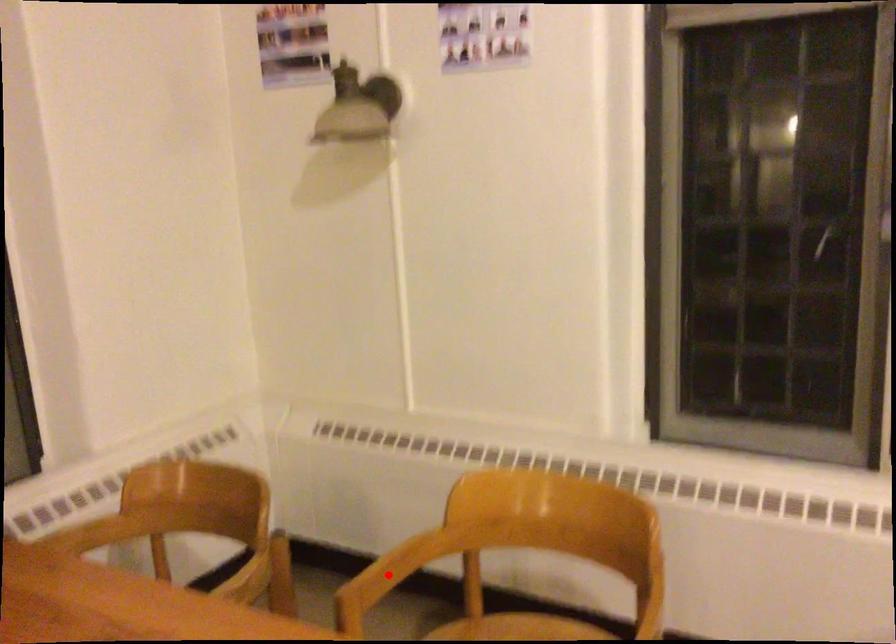
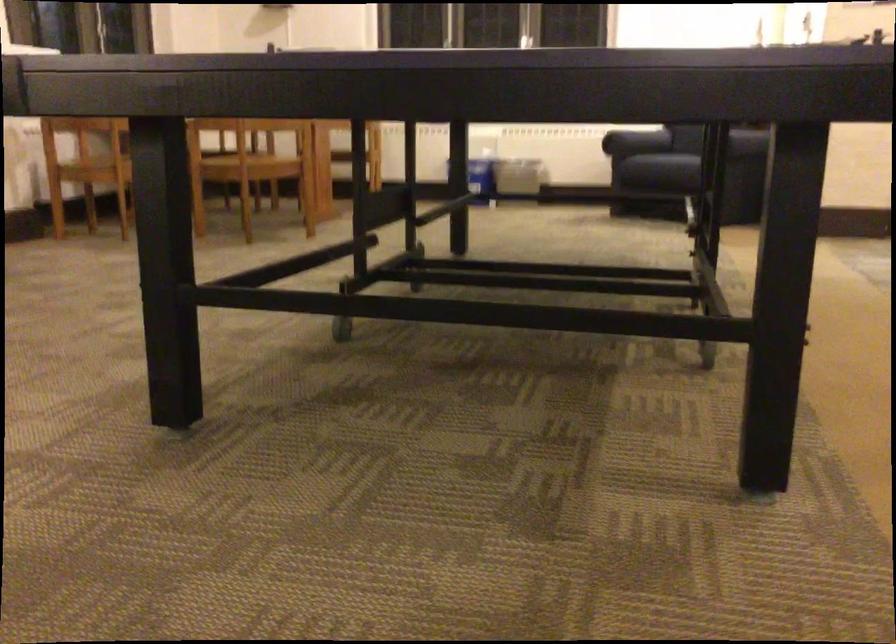
Question: I am providing you with two images of the same scene from different viewpoints. A red point is marked on the first image. Is the red point's position out of view in image 2?

Choices:
 (A) Yes
 (B) No

Answer: (A)